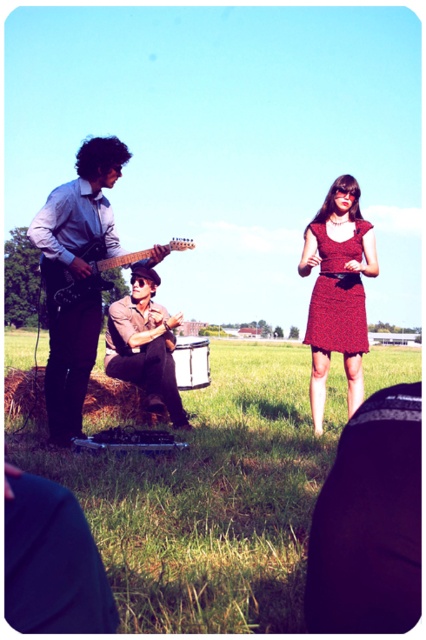
Question: Which object appears closest to the camera in this image?

Choices:
 (A) brown rough hay at lower left
 (B) matte red dress at center

Answer: (B)

Question: Which point is farther to the camera?

Choices:
 (A) green grass at lower center
 (B) red textured dress at center
 (C) brown rough hay at lower left
 (D) metallic drum at center

Answer: (D)

Question: Does matte red dress at center appear on the right side of metallic drum at center?

Choices:
 (A) yes
 (B) no

Answer: (A)

Question: Does shiny black guitar at left appear on the left side of brown rough hay at lower left?

Choices:
 (A) yes
 (B) no

Answer: (A)

Question: Among these points, which one is farthest from the camera?

Choices:
 (A) (353, 289)
 (B) (324, 323)
 (C) (78, 298)
 (D) (175, 413)

Answer: (D)

Question: Observing the image, what is the correct spatial positioning of shiny black guitar at left in reference to metallic drum at center?

Choices:
 (A) below
 (B) above

Answer: (B)